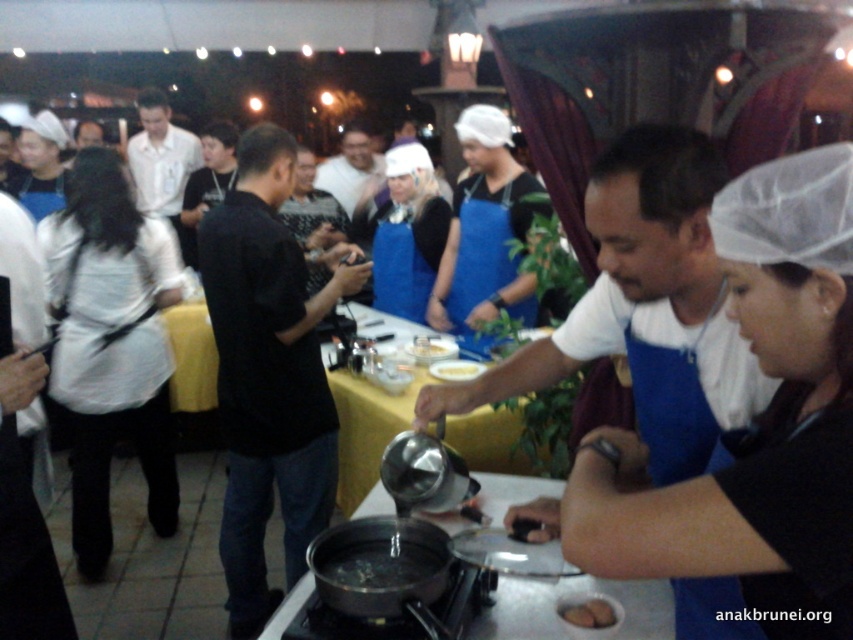
Who is lower down, blue fabric apron at center or matte black shirt at center?

Positioned lower is blue fabric apron at center.

Is the position of blue fabric apron at center less distant than that of matte black shirt at center?

That is True.

You are a GUI agent. You are given a task and a screenshot of the screen. Output one action in this format:
    pyautogui.click(x=<x>, y=<y>)
    Task: Click on the blue fabric apron at center
    The height and width of the screenshot is (640, 853).
    Given the screenshot: What is the action you would take?
    pyautogui.click(x=645, y=308)

Can you confirm if blue fabric apron at center is shorter than black matte shirt at center?

Yes, blue fabric apron at center is shorter than black matte shirt at center.

Who is more forward, (666, 216) or (292, 458)?

Point (666, 216) is in front.

Find the location of a particular element. The image size is (853, 640). blue fabric apron at center is located at coordinates click(x=645, y=308).

Is black matte shirt at center positioned at the back of white matte shirt at center?

No, it is not.

Where is `black matte shirt at center`? This screenshot has height=640, width=853. black matte shirt at center is located at coordinates click(268, 372).

This screenshot has height=640, width=853. I want to click on black matte shirt at center, so click(x=268, y=372).